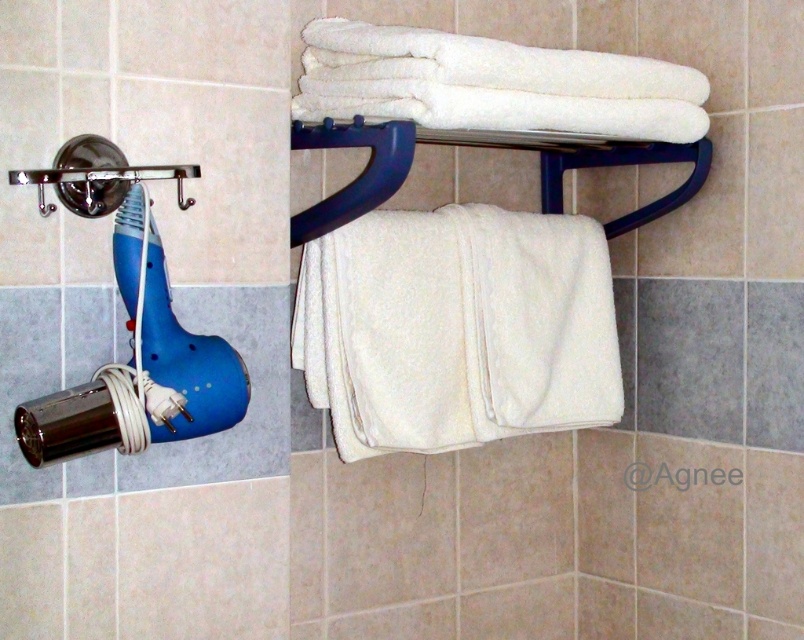
Can you confirm if white soft towel at upper right is taller than white soft towel at upper center?

Indeed, white soft towel at upper right has a greater height compared to white soft towel at upper center.

Which is more to the left, white soft towel at upper right or white soft towel at upper center?

white soft towel at upper center is more to the left.

Between point (626, 99) and point (345, 112), which one is positioned in front?

Positioned in front is point (345, 112).

Identify the location of white soft towel at upper right. This screenshot has width=804, height=640. (482, 65).

Does white soft towel at upper right have a greater width compared to brushed metal shower head at left?

Yes.

Based on the photo, who is positioned more to the left, white soft towel at upper right or brushed metal shower head at left?

From the viewer's perspective, brushed metal shower head at left appears more on the left side.

Who is more forward, (386, 26) or (80, 180)?

Point (80, 180)

Where is `white soft towel at upper right`? The height and width of the screenshot is (640, 804). white soft towel at upper right is located at coordinates (482, 65).

Is white soft towel at upper center to the left of brushed metal shower head at left from the viewer's perspective?

In fact, white soft towel at upper center is to the right of brushed metal shower head at left.

Is white soft towel at upper center wider than brushed metal shower head at left?

Correct, the width of white soft towel at upper center exceeds that of brushed metal shower head at left.

Between point (647, 99) and point (76, 214), which one is positioned in front?

Point (76, 214) is more forward.

Where is `white soft towel at upper center`? Image resolution: width=804 pixels, height=640 pixels. white soft towel at upper center is located at coordinates (503, 109).